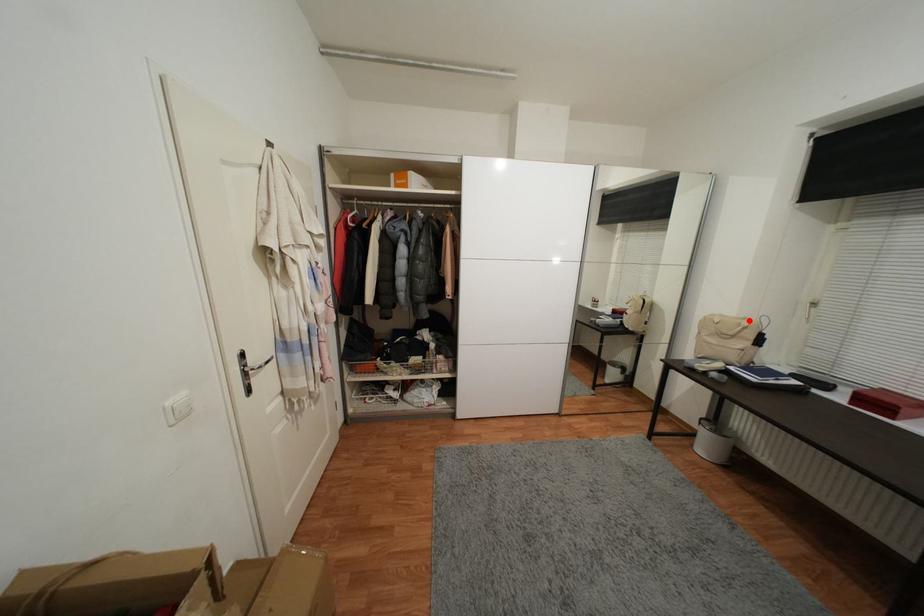
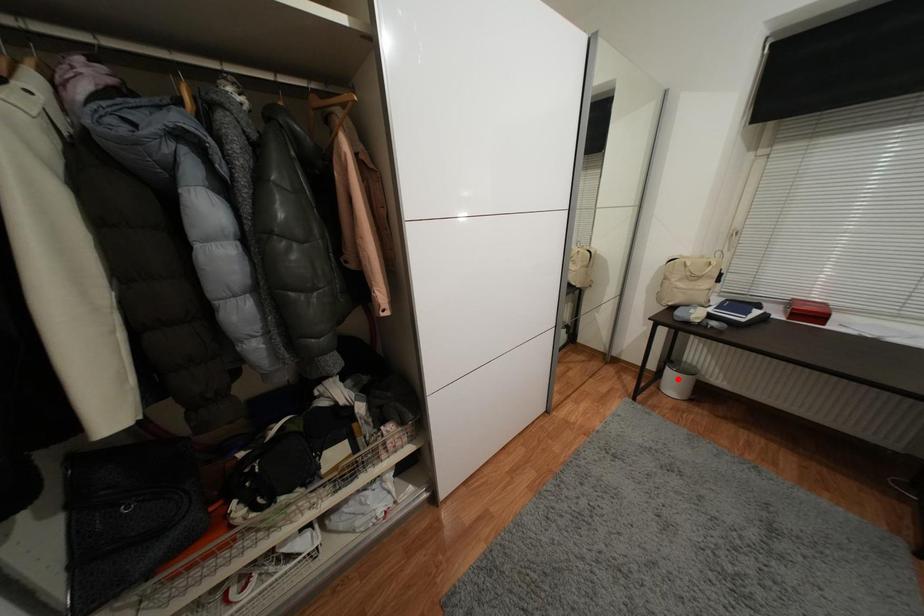
I am providing you with two images of the same scene from different viewpoints. A red point is marked on the first image and another point is marked on the second image. Is the red point in image1 aligned with the point shown in image2?

No